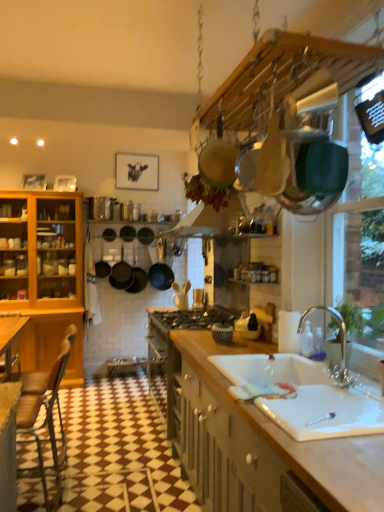
Image resolution: width=384 pixels, height=512 pixels. Describe the element at coordinates (121, 274) in the screenshot. I see `black matte frying pan at center` at that location.

Locate an element on the screen. black matte frying pan at center is located at coordinates (121, 274).

This screenshot has height=512, width=384. Describe the element at coordinates (45, 413) in the screenshot. I see `brown leather chair at lower left` at that location.

Locate an element on the screen. The height and width of the screenshot is (512, 384). brown leather chair at lower left is located at coordinates (45, 413).

This screenshot has width=384, height=512. What do you see at coordinates (303, 396) in the screenshot?
I see `white ceramic sink at lower center` at bounding box center [303, 396].

Find the location of a particular element. black matte frying pan at center is located at coordinates (121, 274).

Is chrome metallic faucet at sink right surrounded by white wood countertop at lower right?

No, white wood countertop at lower right does not contain chrome metallic faucet at sink right.

From the image's perspective, is white wood countertop at lower right above chrome metallic faucet at sink right?

No, from the image's perspective, white wood countertop at lower right is not over chrome metallic faucet at sink right.

Can you tell me how much white wood countertop at lower right and chrome metallic faucet at sink right differ in facing direction?

The angle between the facing direction of white wood countertop at lower right and the facing direction of chrome metallic faucet at sink right is 0.169 degrees.

Does white wood countertop at lower right have a smaller size compared to chrome metallic faucet at sink right?

No, white wood countertop at lower right is not smaller than chrome metallic faucet at sink right.

From the image's perspective, is brown leather chair at lower left under white ceramic sink at lower center?

Indeed, from the image's perspective, brown leather chair at lower left is shown beneath white ceramic sink at lower center.

From a real-world perspective, is brown leather chair at lower left physically below white ceramic sink at lower center?

Indeed, from a real-world perspective, brown leather chair at lower left is positioned beneath white ceramic sink at lower center.

Considering the sizes of brown leather chair at lower left and white ceramic sink at lower center in the image, is brown leather chair at lower left wider or thinner than white ceramic sink at lower center?

Considering their sizes, brown leather chair at lower left looks slimmer than white ceramic sink at lower center.

Is chrome metallic faucet at sink right positioned with its back to brown leather chair at lower left?

No.

Is chrome metallic faucet at sink right touching brown leather chair at lower left?

No.

Considering the sizes of chrome metallic faucet at sink right and brown leather chair at lower left in the image, is chrome metallic faucet at sink right wider or thinner than brown leather chair at lower left?

Clearly, chrome metallic faucet at sink right has less width compared to brown leather chair at lower left.

Is chrome metallic faucet at sink right in front of or behind brown leather chair at lower left in the image?

Visually, chrome metallic faucet at sink right is located in front of brown leather chair at lower left.

Consider the image. Which object is further away from the camera, white ceramic sink at lower center or chrome metallic faucet at sink right?

chrome metallic faucet at sink right is further from the camera.

Is white ceramic sink at lower center oriented towards chrome metallic faucet at sink right?

No, white ceramic sink at lower center is not oriented towards chrome metallic faucet at sink right.

Is chrome metallic faucet at sink right surrounded by white ceramic sink at lower center?

No, chrome metallic faucet at sink right is not inside white ceramic sink at lower center.

Does white ceramic sink at lower center have a lesser height compared to chrome metallic faucet at sink right?

Correct, white ceramic sink at lower center is not as tall as chrome metallic faucet at sink right.

This screenshot has height=512, width=384. I want to click on countertop below the chrome metallic faucet at sink right (from a real-world perspective), so click(x=258, y=444).

Is chrome metallic faucet at sink right positioned beyond the bounds of white wood countertop at lower right?

Yes.

From the image's perspective, which one is positioned higher, chrome metallic faucet at sink right or white wood countertop at lower right?

chrome metallic faucet at sink right, from the image's perspective.

From their relative heights in the image, would you say chrome metallic faucet at sink right is taller or shorter than white wood countertop at lower right?

chrome metallic faucet at sink right is shorter than white wood countertop at lower right.

Locate an element on the screen. The width and height of the screenshot is (384, 512). countertop that is on the left side of white ceramic sink at lower center is located at coordinates (258, 444).

From the picture: In terms of height, does white ceramic sink at lower center look taller or shorter compared to white wood countertop at lower right?

white ceramic sink at lower center is shorter than white wood countertop at lower right.

Is white ceramic sink at lower center facing towards white wood countertop at lower right?

Yes, white ceramic sink at lower center faces towards white wood countertop at lower right.

Is white ceramic sink at lower center with white wood countertop at lower right?

No, white ceramic sink at lower center is not making contact with white wood countertop at lower right.

Considering the relative sizes of black matte frying pan at center and chrome metallic faucet at sink right in the image provided, is black matte frying pan at center bigger than chrome metallic faucet at sink right?

Correct, black matte frying pan at center is larger in size than chrome metallic faucet at sink right.

Considering the relative sizes of black matte frying pan at center and chrome metallic faucet at sink right in the image provided, is black matte frying pan at center taller than chrome metallic faucet at sink right?

Indeed, black matte frying pan at center has a greater height compared to chrome metallic faucet at sink right.

Is black matte frying pan at center further to camera compared to chrome metallic faucet at sink right?

Yes.

Which is more to the left, black matte frying pan at center or chrome metallic faucet at sink right?

From the viewer's perspective, black matte frying pan at center appears more on the left side.

There is a white wood countertop at lower right. At what (x,y) coordinates should I click in order to perform the action: click on tap above it (from a real-world perspective). Please return your answer as a coordinate pair (x, y). This screenshot has width=384, height=512. Looking at the image, I should click on (340, 346).

In the image, there is a brown leather chair at lower left. Identify the location of sink above it (from the image's perspective). (303, 396).

Considering their positions, is white ceramic sink at lower center positioned closer to white wood countertop at lower right than black matte frying pan at center?

white ceramic sink at lower center is positioned closer to the anchor white wood countertop at lower right.

Looking at the image, which one is located further to chrome metallic faucet at sink right, brown leather chair at lower left or white wood countertop at lower right?

brown leather chair at lower left.

When comparing their distances from white wood countertop at lower right, does chrome metallic faucet at sink right or black matte frying pan at center seem further?

Based on the image, black matte frying pan at center appears to be further to white wood countertop at lower right.

Estimate the real-world distances between objects in this image. Which object is closer to brown leather chair at lower left, black matte frying pan at center or chrome metallic faucet at sink right?

Among the two, chrome metallic faucet at sink right is located nearer to brown leather chair at lower left.

Which object lies nearer to the anchor point brown leather chair at lower left, white wood countertop at lower right or white ceramic sink at lower center?

Based on the image, white wood countertop at lower right appears to be nearer to brown leather chair at lower left.

Looking at the image, which one is located closer to black matte frying pan at center, brown leather chair at lower left or chrome metallic faucet at sink right?

brown leather chair at lower left lies closer to black matte frying pan at center than the other object.

Looking at the image, which one is located closer to white wood countertop at lower right, brown leather chair at lower left or chrome metallic faucet at sink right?

Based on the image, chrome metallic faucet at sink right appears to be nearer to white wood countertop at lower right.

Based on their spatial positions, is white ceramic sink at lower center or white wood countertop at lower right closer to black matte frying pan at center?

white wood countertop at lower right.

Locate an element on the screen. This screenshot has height=512, width=384. chair located between white ceramic sink at lower center and black matte frying pan at center in the depth direction is located at coordinates (45, 413).

Where is `tap between white ceramic sink at lower center and black matte frying pan at center in the front-back direction`? tap between white ceramic sink at lower center and black matte frying pan at center in the front-back direction is located at coordinates (340, 346).

Find the location of a particular element. Image resolution: width=384 pixels, height=512 pixels. sink between chrome metallic faucet at sink right and white wood countertop at lower right vertically is located at coordinates (303, 396).

Where is `countertop between brown leather chair at lower left and chrome metallic faucet at sink right`? The width and height of the screenshot is (384, 512). countertop between brown leather chair at lower left and chrome metallic faucet at sink right is located at coordinates (258, 444).